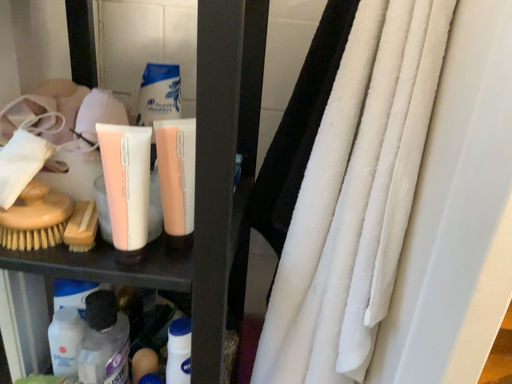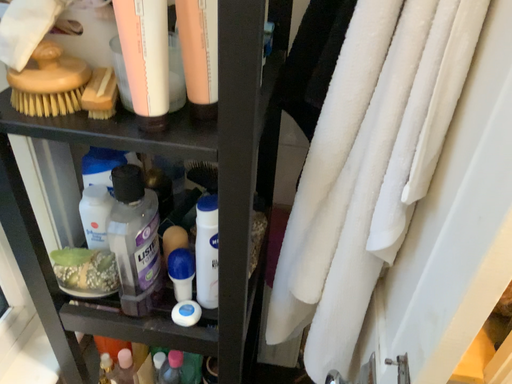
Question: Which way did the camera rotate in the video?

Choices:
 (A) rotated upward
 (B) rotated downward

Answer: (B)